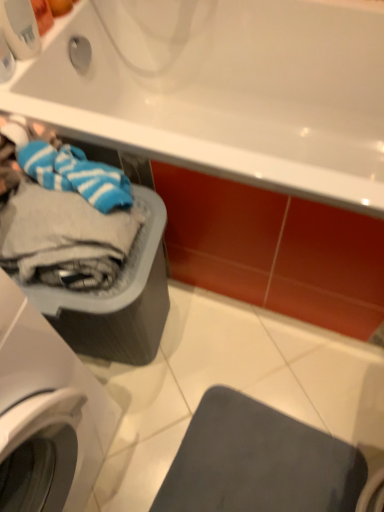
Identify the location of free point above matte gray mat at lower right (from a real-world perspective). (268, 465).